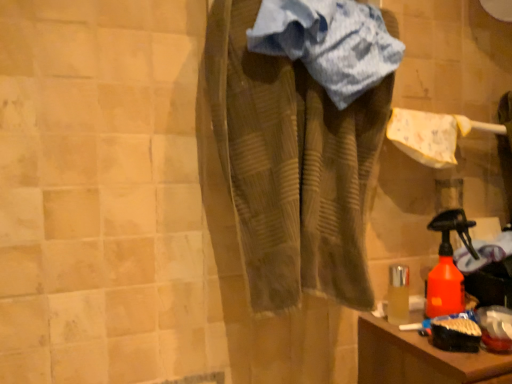
Question: Does point (324, 264) appear closer or farther from the camera than point (263, 46)?

Choices:
 (A) farther
 (B) closer

Answer: (A)

Question: Based on their sizes in the image, would you say brown textured towel at center is bigger or smaller than blue striped towel at center?

Choices:
 (A) big
 (B) small

Answer: (A)

Question: Based on their relative distances, which object is nearer to the blue striped towel at center?

Choices:
 (A) orange matte spray bottle at lower right
 (B) brown textured towel at center

Answer: (B)

Question: Which is farther from the brown textured towel at center?

Choices:
 (A) blue striped towel at center
 (B) orange matte spray bottle at lower right

Answer: (B)